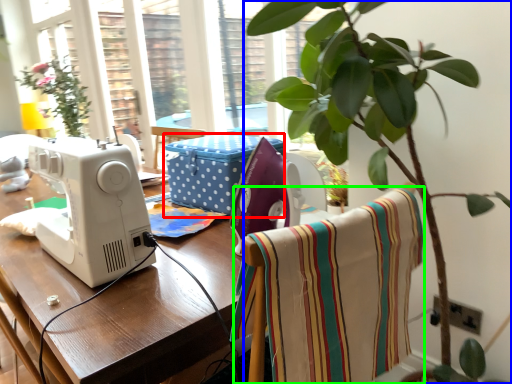
Question: Which object is positioned farthest from box (highlighted by a red box)? Select from houseplant (highlighted by a blue box) and blanket (highlighted by a green box).

Choices:
 (A) houseplant
 (B) blanket

Answer: (B)